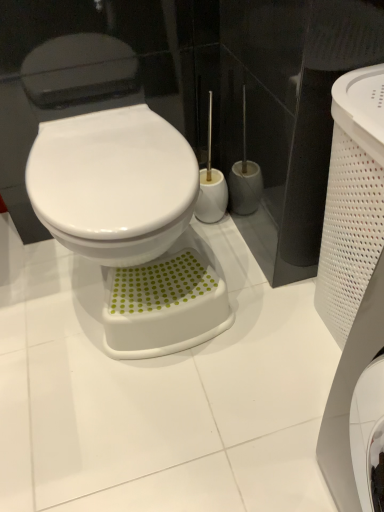
Question: Considering the positions of white glossy bidet at center and green dotted plastic step stool at lower center in the image, is white glossy bidet at center taller or shorter than green dotted plastic step stool at lower center?

Choices:
 (A) short
 (B) tall

Answer: (B)

Question: Considering the positions of point (54, 208) and point (105, 330), is point (54, 208) closer or farther from the camera than point (105, 330)?

Choices:
 (A) farther
 (B) closer

Answer: (B)

Question: Relative to green dotted plastic step stool at lower center, is white glossy bidet at center in front or behind?

Choices:
 (A) behind
 (B) front

Answer: (B)

Question: Considering the positions of green dotted plastic step stool at lower center and white glossy bidet at center in the image, is green dotted plastic step stool at lower center wider or thinner than white glossy bidet at center?

Choices:
 (A) wide
 (B) thin

Answer: (B)

Question: Is point (125, 305) positioned closer to the camera than point (127, 181)?

Choices:
 (A) closer
 (B) farther

Answer: (B)

Question: Is green dotted plastic step stool at lower center inside or outside of white glossy bidet at center?

Choices:
 (A) inside
 (B) outside

Answer: (B)

Question: From a real-world perspective, is green dotted plastic step stool at lower center physically located above or below white glossy bidet at center?

Choices:
 (A) above
 (B) below

Answer: (B)